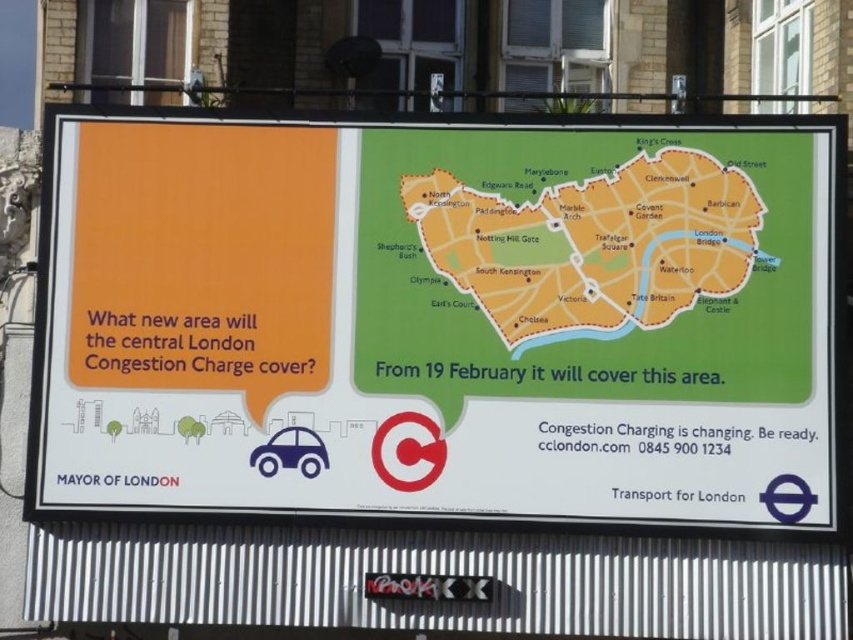
From the picture: You are a delivery driver who needs to check the distance between the white paper map at upper center and the orange paper map at center on the billboard. Your delivery truck has a 33 inch wide cargo space. Can you fit both maps side by side in your truck without folding them?

The white paper map at upper center and orange paper map at center are 33.29 inches apart from each other. Since the distance between them is greater than the truck cargo space width of 33 inches, you cannot fit both maps side by side without folding them.

You are a tourist in London trying to understand the new Congestion Charge areas. You see the white paper map at upper center and the orange paper map at center on the billboard. Which map is taller?

The white paper map at upper center is taller than the orange paper map at center.